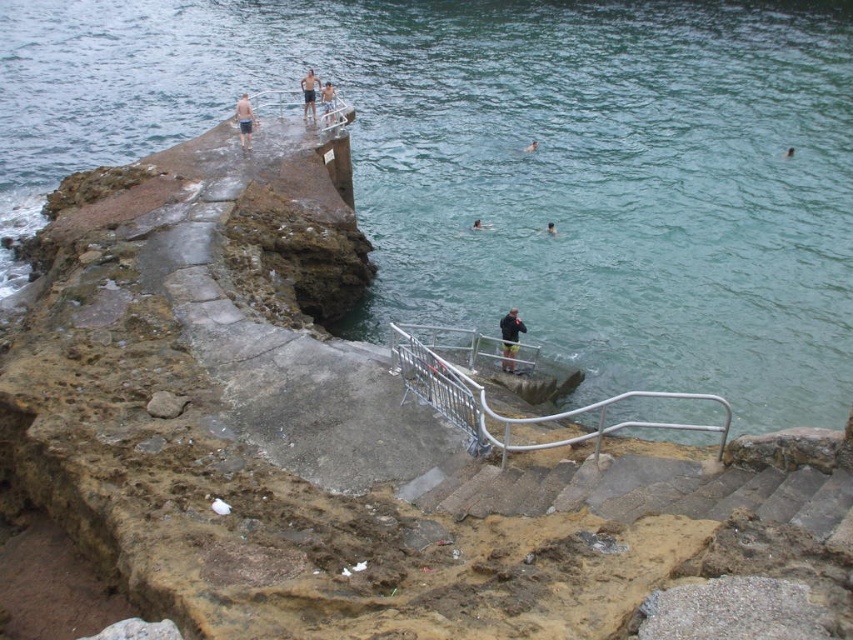
Question: Among these objects, which one is nearest to the camera?

Choices:
 (A) black matte jacket at center
 (B) skinny man at upper center
 (C) light blue shorts at center

Answer: (A)

Question: Does silver metallic rail at center appear over skinny man at upper center?

Choices:
 (A) no
 (B) yes

Answer: (A)

Question: Which object is farther from the camera taking this photo?

Choices:
 (A) silver metallic rail at center
 (B) skinny man at lower center
 (C) black matte jacket at center
 (D) light blue shorts at center

Answer: (B)

Question: Based on their relative distances, which object is nearer to the brown skin at water?

Choices:
 (A) smooth skin person at center
 (B) greenish-blue water at upper center
 (C) silver metallic rail at center

Answer: (A)

Question: Is silver metallic rail at center bigger than light blue shorts at center?

Choices:
 (A) yes
 (B) no

Answer: (B)

Question: In this image, where is skinny man at upper center located relative to smooth skin person at center?

Choices:
 (A) above
 (B) below

Answer: (A)